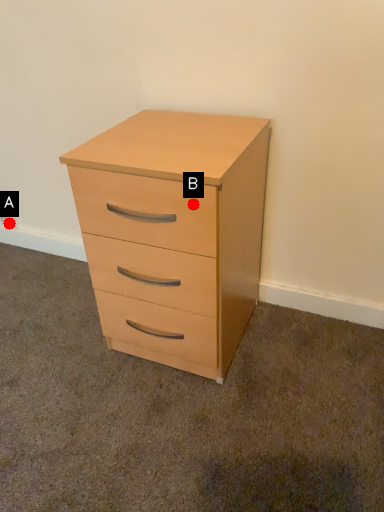
Question: Two points are circled on the image, labeled by A and B beside each circle. Among these points, which one is nearest to the camera?

Choices:
 (A) A is closer
 (B) B is closer

Answer: (B)